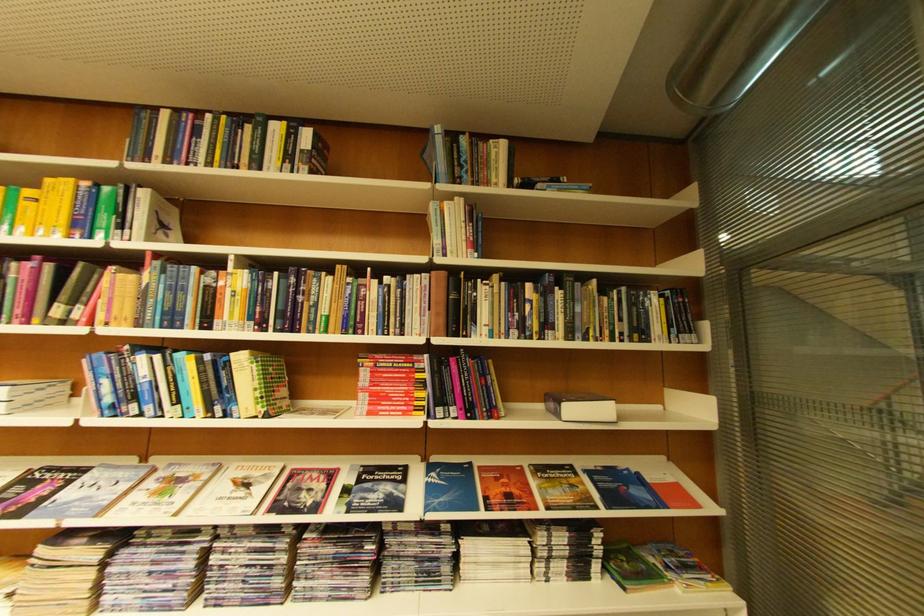
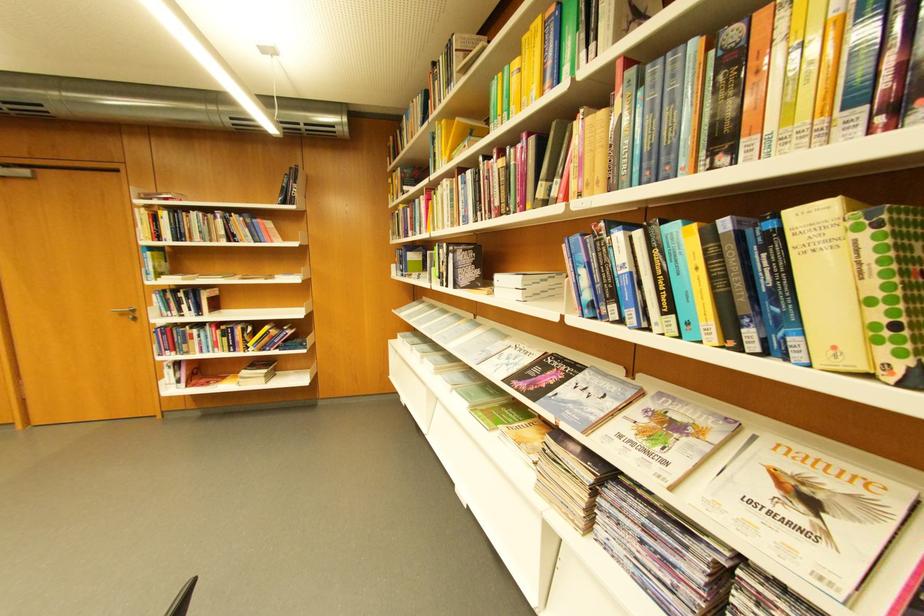
Question: The camera is either moving clockwise (left) or counter-clockwise (right) around the object. The first image is from the beginning of the video and the second image is from the end. Is the camera moving left or right when shooting the video?

Choices:
 (A) Left
 (B) Right

Answer: (B)